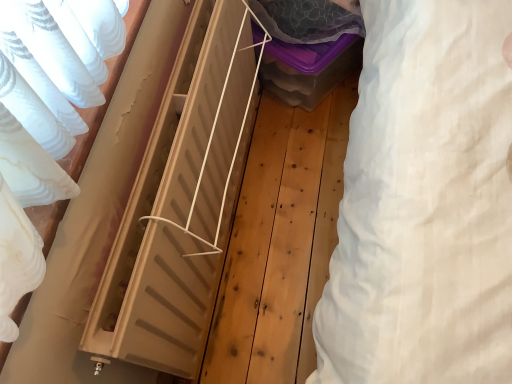
Question: From a real-world perspective, does white cotton sheet at right stand above natural wood radiator at center?

Choices:
 (A) yes
 (B) no

Answer: (A)

Question: Is white cotton sheet at right oriented towards natural wood radiator at center?

Choices:
 (A) no
 (B) yes

Answer: (B)

Question: From a real-world perspective, is white cotton sheet at right under natural wood radiator at center?

Choices:
 (A) yes
 (B) no

Answer: (B)

Question: From the image's perspective, would you say white cotton sheet at right is shown under natural wood radiator at center?

Choices:
 (A) no
 (B) yes

Answer: (A)

Question: Is white cotton sheet at right not near natural wood radiator at center?

Choices:
 (A) no
 (B) yes

Answer: (A)

Question: Does white cotton sheet at right have a smaller size compared to natural wood radiator at center?

Choices:
 (A) no
 (B) yes

Answer: (B)

Question: Considering the relative sizes of natural wood radiator at center and white cotton sheet at right in the image provided, is natural wood radiator at center thinner than white cotton sheet at right?

Choices:
 (A) no
 (B) yes

Answer: (A)

Question: From a real-world perspective, does natural wood radiator at center stand above white cotton sheet at right?

Choices:
 (A) no
 (B) yes

Answer: (A)

Question: Are natural wood radiator at center and white cotton sheet at right located far from each other?

Choices:
 (A) yes
 (B) no

Answer: (B)

Question: From the image's perspective, is natural wood radiator at center beneath white cotton sheet at right?

Choices:
 (A) yes
 (B) no

Answer: (A)

Question: Can you confirm if natural wood radiator at center is smaller than white cotton sheet at right?

Choices:
 (A) yes
 (B) no

Answer: (B)

Question: Can you confirm if natural wood radiator at center is taller than white cotton sheet at right?

Choices:
 (A) no
 (B) yes

Answer: (A)

Question: Does translucent plastic storage box at center have a lesser height compared to white cotton sheet at right?

Choices:
 (A) yes
 (B) no

Answer: (A)